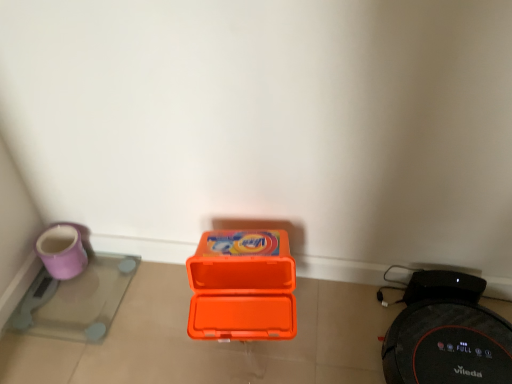
You are a GUI agent. You are given a task and a screenshot of the screen. Output one action in this format:
    pyautogui.click(x=<x>, y=<y>)
    Task: Click on the free point above purple glossy scale at lower left, the first appliance viewed from the left (from a real-world perspective)
    This screenshot has width=512, height=384.
    Given the screenshot: What is the action you would take?
    pyautogui.click(x=75, y=293)